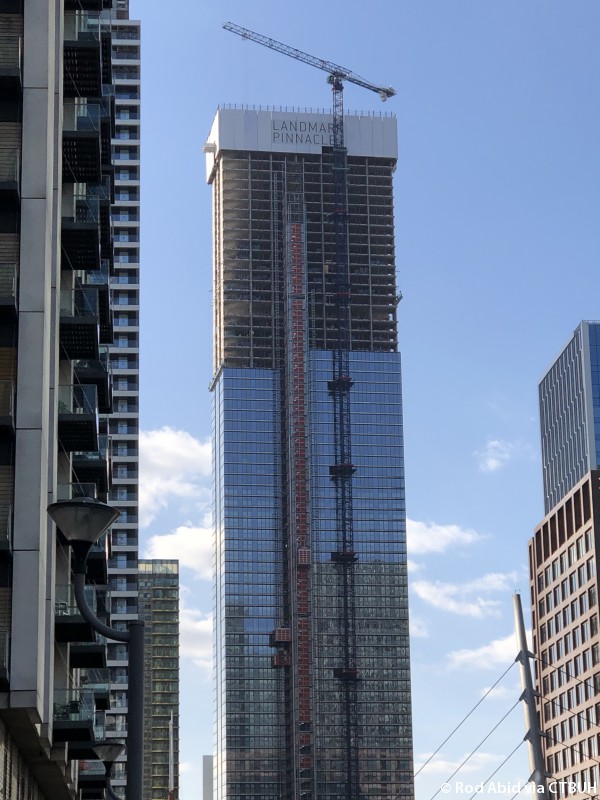
Where is `chairs on balcony on left building`? This screenshot has height=800, width=600. chairs on balcony on left building is located at coordinates (63, 608), (63, 710).